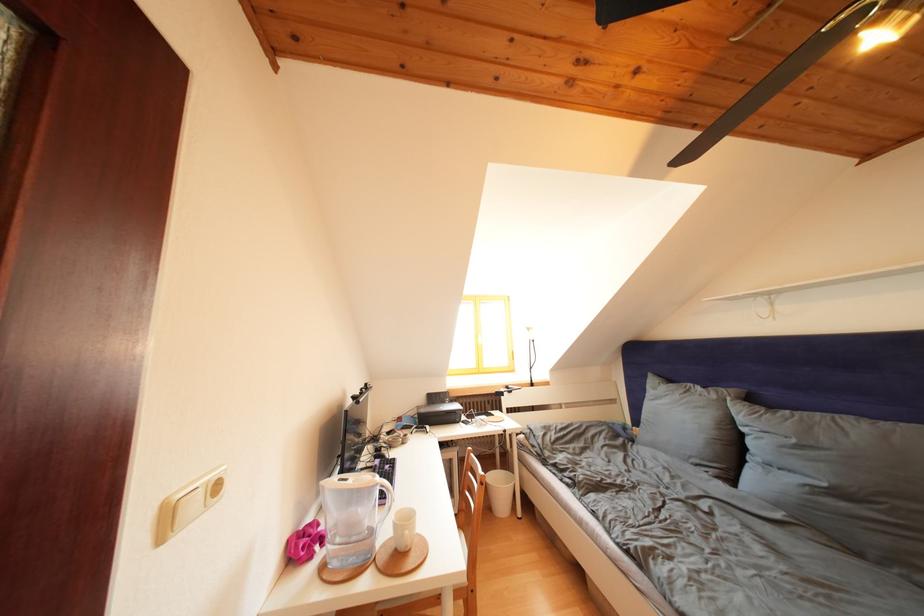
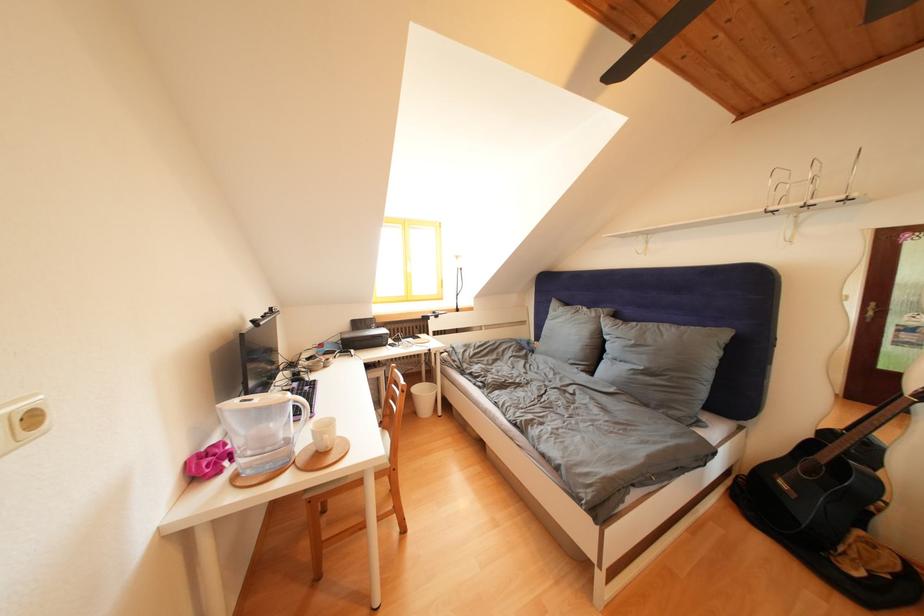
Find the pixel in the second image that matches point (385, 482) in the first image.

(297, 400)